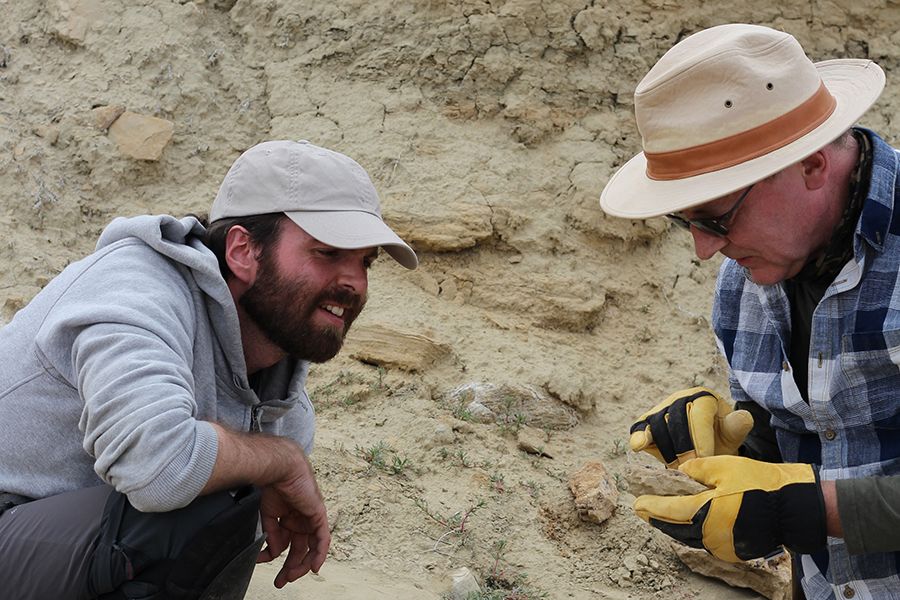
At what (x,y) coordinates should I click in order to perform the action: click on hood. Please return your answer as a coordinate pair (x, y). Looking at the image, I should click on (148, 225).